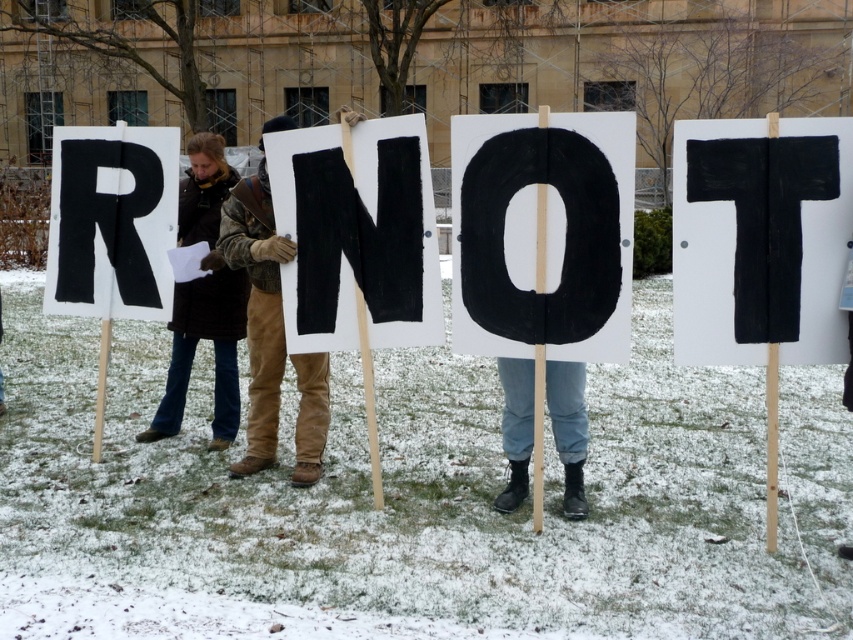
You are a photographer trying to capture a clear photo of the brown leather gloves at center and the brown leather jacket at left. Since the gloves are shorter than the jacket, where should you position your camera to ensure both are fully visible in the frame?

Since the brown leather gloves at center is shorter than the brown leather jacket at left, position the camera at a lower angle to include both the lower position of the gloves and the taller jacket in the frame.

You are a photographer trying to capture a clear shot of the brown leather gloves at center and the brown leather jacket at left. If you want to focus on the smaller object, which one should you aim for?

The brown leather gloves at center has a lesser width compared to the brown leather jacket at left, so you should aim for the brown leather gloves at center since it is smaller.

Looking at this image, you are standing in the snowy area and want to reach the point marked at coordinates (360,157). Given that you can walk 3 feet per second, how long will it take you to reach that point?

The point at coordinates (360,157) is 19.32 feet away from the viewer. At a walking speed of 3 feet per second, it would take approximately 6.44 seconds to reach it.